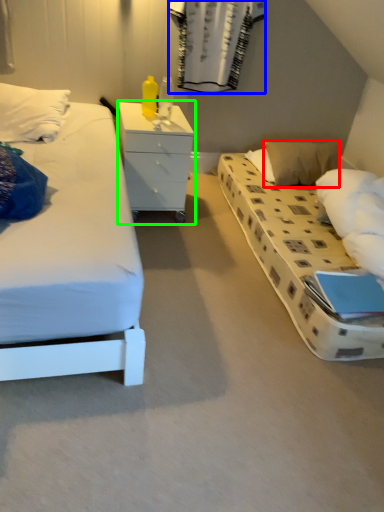
Question: Which object is positioned farthest from pillow (highlighted by a red box)? Select from curtain (highlighted by a blue box) and chest of drawers (highlighted by a green box).

Choices:
 (A) curtain
 (B) chest of drawers

Answer: (B)